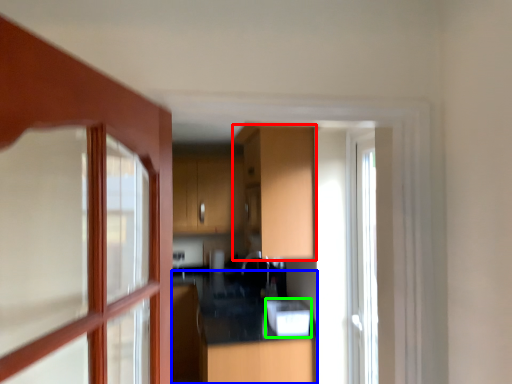
Question: Which object is positioned closest to cabinetry (highlighted by a red box)? Select from counter top (highlighted by a blue box) and appliance (highlighted by a green box).

Choices:
 (A) counter top
 (B) appliance

Answer: (B)